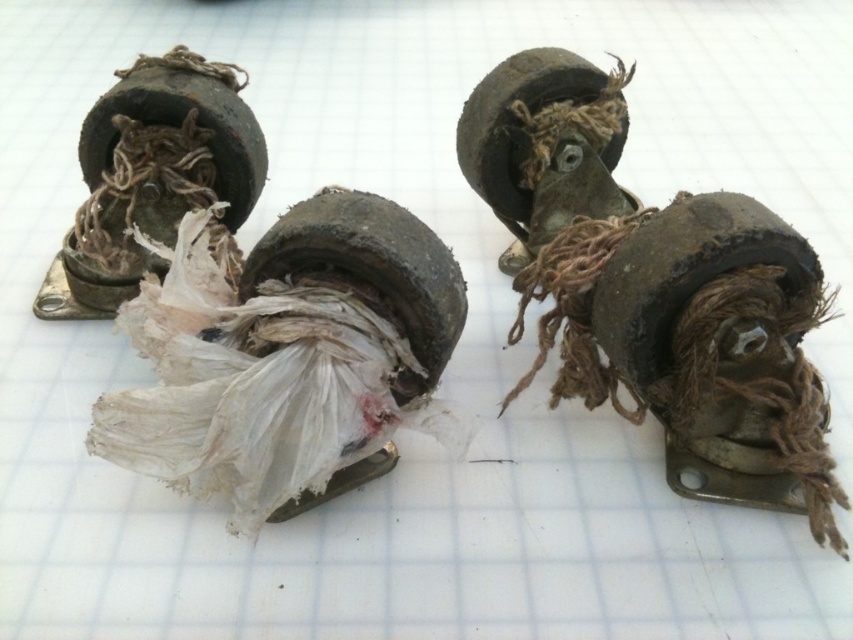
Can you confirm if rusty metal roller skate at center is positioned to the left of rusty metal wheel at upper right?

Incorrect, rusty metal roller skate at center is not on the left side of rusty metal wheel at upper right.

Does rusty metal roller skate at center have a smaller size compared to rusty metal wheel at upper right?

No.

I want to click on rusty metal roller skate at center, so click(653, 284).